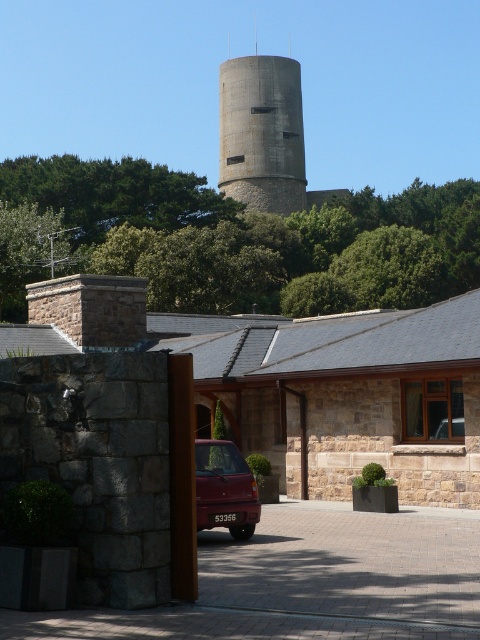
Question: Which of the following is the closest to the observer?

Choices:
 (A) paved brick driveway at center
 (B) concrete water tower at center

Answer: (A)

Question: Considering the relative positions of paved brick driveway at center and concrete water tower at center in the image provided, where is paved brick driveway at center located with respect to concrete water tower at center?

Choices:
 (A) below
 (B) above

Answer: (A)

Question: Which point appears closest to the camera in this image?

Choices:
 (A) (207, 500)
 (B) (444, 604)
 (C) (275, 209)

Answer: (B)

Question: Which point is farther from the camera taking this photo?

Choices:
 (A) (252, 605)
 (B) (254, 134)
 (C) (216, 472)

Answer: (B)

Question: Is concrete water tower at center positioned before shiny maroon sedan at center?

Choices:
 (A) no
 (B) yes

Answer: (A)

Question: Does paved brick driveway at center lie behind concrete water tower at center?

Choices:
 (A) no
 (B) yes

Answer: (A)